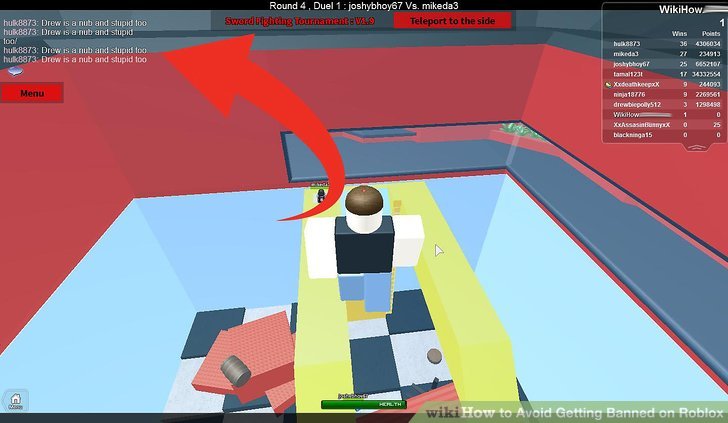
Find the location of `virtual blue walls`. virtual blue walls is located at coordinates (571, 292), (129, 320), (280, 195).